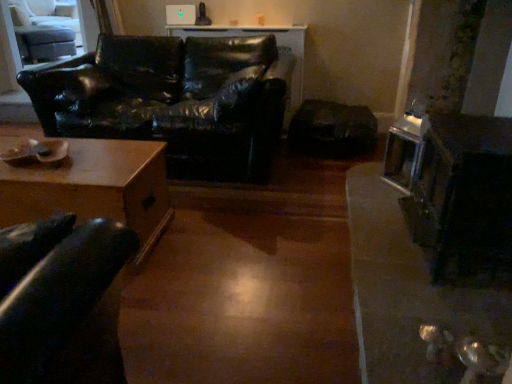
Question: Can black leather couch at left be found inside metallic silver fireplace at right?

Choices:
 (A) no
 (B) yes

Answer: (A)

Question: Is the surface of metallic silver fireplace at right in direct contact with black leather couch at left?

Choices:
 (A) no
 (B) yes

Answer: (A)

Question: Is metallic silver fireplace at right further to camera compared to black leather couch at left?

Choices:
 (A) yes
 (B) no

Answer: (B)

Question: Is metallic silver fireplace at right positioned in front of black leather couch at left?

Choices:
 (A) yes
 (B) no

Answer: (A)

Question: Is metallic silver fireplace at right positioned with its back to black leather couch at left?

Choices:
 (A) yes
 (B) no

Answer: (B)

Question: From the image's perspective, is metallic silver fireplace at right below black leather couch at left?

Choices:
 (A) no
 (B) yes

Answer: (B)

Question: From the image's perspective, would you say black leather couch at left is positioned over metallic silver fireplace at right?

Choices:
 (A) yes
 (B) no

Answer: (A)

Question: Considering the relative sizes of black leather couch at left and metallic silver fireplace at right in the image provided, is black leather couch at left smaller than metallic silver fireplace at right?

Choices:
 (A) yes
 (B) no

Answer: (B)

Question: Is black leather couch at left not close to metallic silver fireplace at right?

Choices:
 (A) no
 (B) yes

Answer: (B)

Question: From a real-world perspective, is black leather couch at left on top of metallic silver fireplace at right?

Choices:
 (A) yes
 (B) no

Answer: (B)

Question: Is black leather couch at left oriented towards metallic silver fireplace at right?

Choices:
 (A) no
 (B) yes

Answer: (A)

Question: Is black leather couch at left shorter than metallic silver fireplace at right?

Choices:
 (A) yes
 (B) no

Answer: (A)

Question: Can you see metallic silver fireplace at right touching light gray fabric swivel chair at upper left?

Choices:
 (A) yes
 (B) no

Answer: (B)